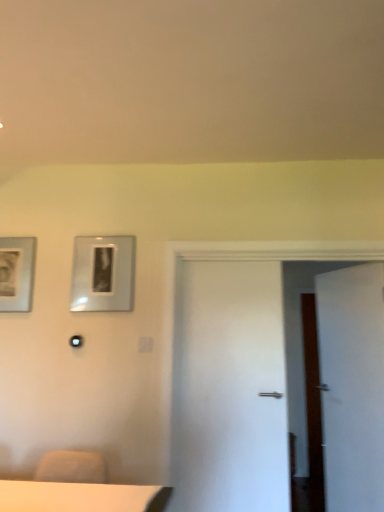
The width and height of the screenshot is (384, 512). Describe the element at coordinates (103, 273) in the screenshot. I see `metallic silver picture frame at upper left, the second picture frame positioned from the left` at that location.

At what (x,y) coordinates should I click in order to perform the action: click on white matte door at right. Please return your answer as a coordinate pair (x, y). The image size is (384, 512). Looking at the image, I should click on (352, 385).

Considering the sizes of white matte door at right and matte silver picture frame at left, the second picture frame viewed from the right, in the image, is white matte door at right taller or shorter than matte silver picture frame at left, the second picture frame viewed from the right,?

Clearly, white matte door at right is taller compared to matte silver picture frame at left, the second picture frame viewed from the right.

Considering the relative positions of white matte door at right and matte silver picture frame at left, placed as the 1th picture frame when sorted from left to right, in the image provided, is white matte door at right to the right of matte silver picture frame at left, placed as the 1th picture frame when sorted from left to right, from the viewer's perspective?

Yes, white matte door at right is to the right of matte silver picture frame at left, placed as the 1th picture frame when sorted from left to right.

Can we say white matte door at right lies outside matte silver picture frame at left, the second picture frame viewed from the right?

Yes, white matte door at right is located beyond the bounds of matte silver picture frame at left, the second picture frame viewed from the right.

Is matte silver picture frame at left, the second picture frame viewed from the right, smaller than metallic silver picture frame at upper left, the second picture frame positioned from the left?

Yes, matte silver picture frame at left, the second picture frame viewed from the right, is smaller than metallic silver picture frame at upper left, the second picture frame positioned from the left.

Measure the distance from matte silver picture frame at left, placed as the 1th picture frame when sorted from left to right, to metallic silver picture frame at upper left, the first picture frame from the right.

matte silver picture frame at left, placed as the 1th picture frame when sorted from left to right, is 17.99 inches away from metallic silver picture frame at upper left, the first picture frame from the right.

Could you tell me if matte silver picture frame at left, placed as the 1th picture frame when sorted from left to right, is turned towards metallic silver picture frame at upper left, the second picture frame positioned from the left?

No, matte silver picture frame at left, placed as the 1th picture frame when sorted from left to right, is not facing towards metallic silver picture frame at upper left, the second picture frame positioned from the left.

Does matte silver picture frame at left, the second picture frame viewed from the right, have a greater height compared to metallic silver picture frame at upper left, the first picture frame from the right?

Yes, matte silver picture frame at left, the second picture frame viewed from the right, is taller than metallic silver picture frame at upper left, the first picture frame from the right.

How distant is metallic silver picture frame at upper left, the second picture frame positioned from the left, from matte silver picture frame at left, placed as the 1th picture frame when sorted from left to right?

The distance of metallic silver picture frame at upper left, the second picture frame positioned from the left, from matte silver picture frame at left, placed as the 1th picture frame when sorted from left to right, is 17.99 inches.

How different are the orientations of metallic silver picture frame at upper left, the first picture frame from the right, and matte silver picture frame at left, the second picture frame viewed from the right, in degrees?

1.14 degrees.

From a real-world perspective, which is physically below, metallic silver picture frame at upper left, the second picture frame positioned from the left, or matte silver picture frame at left, placed as the 1th picture frame when sorted from left to right?

From a 3D spatial view, matte silver picture frame at left, placed as the 1th picture frame when sorted from left to right, is below.

From the image's perspective, between metallic silver picture frame at upper left, the second picture frame positioned from the left, and matte silver picture frame at left, the second picture frame viewed from the right, which one is located above?

metallic silver picture frame at upper left, the second picture frame positioned from the left.

Which is correct: metallic silver picture frame at upper left, the first picture frame from the right, is inside white matte door at right, or outside of it?

metallic silver picture frame at upper left, the first picture frame from the right, is spatially situated outside white matte door at right.

From a real-world perspective, between metallic silver picture frame at upper left, the second picture frame positioned from the left, and white matte door at right, who is vertically higher?

From a 3D spatial view, metallic silver picture frame at upper left, the second picture frame positioned from the left, is above.

Between metallic silver picture frame at upper left, the second picture frame positioned from the left, and white matte door at right, which one is positioned behind?

metallic silver picture frame at upper left, the second picture frame positioned from the left, is further away from the camera.

Can you tell me how much metallic silver picture frame at upper left, the first picture frame from the right, and white matte door at right differ in facing direction?

The angular difference between metallic silver picture frame at upper left, the first picture frame from the right, and white matte door at right is 67.6 degrees.

Which is correct: white matte door at right is inside metallic silver picture frame at upper left, the second picture frame positioned from the left, or outside of it?

The correct answer is: outside.

From a real-world perspective, is white matte door at right below metallic silver picture frame at upper left, the first picture frame from the right?

Yes.

How distant is white matte door at right from metallic silver picture frame at upper left, the first picture frame from the right?

white matte door at right is 1.71 meters away from metallic silver picture frame at upper left, the first picture frame from the right.

Which of these two, matte silver picture frame at left, placed as the 1th picture frame when sorted from left to right, or white matte door at right, stands taller?

With more height is white matte door at right.

From a real-world perspective, is matte silver picture frame at left, the second picture frame viewed from the right, physically located above or below white matte door at right?

In terms of real-world spatial position, matte silver picture frame at left, the second picture frame viewed from the right, is above white matte door at right.

Where is `the 2nd picture frame behind the white matte door at right, counting from the anchor's position`? the 2nd picture frame behind the white matte door at right, counting from the anchor's position is located at coordinates (16, 273).

At what (x,y) coordinates should I click in order to perform the action: click on the 1st picture frame positioned above the white matte door at right (from a real-world perspective). Please return your answer as a coordinate pair (x, y). Looking at the image, I should click on (16, 273).

You are a GUI agent. You are given a task and a screenshot of the screen. Output one action in this format:
    pyautogui.click(x=<x>, y=<y>)
    Task: Click on the picture frame behind the metallic silver picture frame at upper left, the first picture frame from the right
    
    Given the screenshot: What is the action you would take?
    pyautogui.click(x=16, y=273)

When comparing their distances from metallic silver picture frame at upper left, the first picture frame from the right, does matte silver picture frame at left, placed as the 1th picture frame when sorted from left to right, or white matte door at right seem further?

The object further to metallic silver picture frame at upper left, the first picture frame from the right, is white matte door at right.

Which object lies further to the anchor point white matte door at right, matte silver picture frame at left, placed as the 1th picture frame when sorted from left to right, or metallic silver picture frame at upper left, the second picture frame positioned from the left?

matte silver picture frame at left, placed as the 1th picture frame when sorted from left to right.

When comparing their distances from metallic silver picture frame at upper left, the first picture frame from the right, does white matte door at right or matte silver picture frame at left, placed as the 1th picture frame when sorted from left to right, seem further?

white matte door at right is further to metallic silver picture frame at upper left, the first picture frame from the right.

Considering their positions, is white matte door at right positioned closer to matte silver picture frame at left, placed as the 1th picture frame when sorted from left to right, than metallic silver picture frame at upper left, the first picture frame from the right?

The object closer to matte silver picture frame at left, placed as the 1th picture frame when sorted from left to right, is metallic silver picture frame at upper left, the first picture frame from the right.

Estimate the real-world distances between objects in this image. Which object is further from white matte door at right, metallic silver picture frame at upper left, the first picture frame from the right, or matte silver picture frame at left, the second picture frame viewed from the right?

Among the two, matte silver picture frame at left, the second picture frame viewed from the right, is located further to white matte door at right.

From the image, which object appears to be farther from matte silver picture frame at left, the second picture frame viewed from the right, metallic silver picture frame at upper left, the first picture frame from the right, or white matte door at right?

white matte door at right is further to matte silver picture frame at left, the second picture frame viewed from the right.

You are a GUI agent. You are given a task and a screenshot of the screen. Output one action in this format:
    pyautogui.click(x=<x>, y=<y>)
    Task: Click on the picture frame between matte silver picture frame at left, the second picture frame viewed from the right, and white matte door at right, in the horizontal direction
    The height and width of the screenshot is (512, 384).
    Given the screenshot: What is the action you would take?
    pyautogui.click(x=103, y=273)